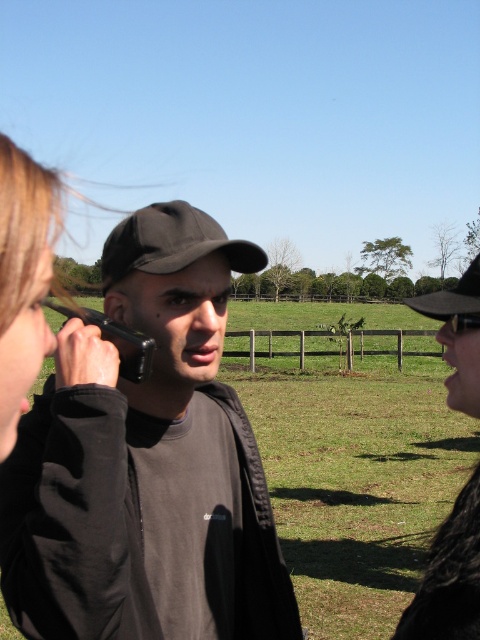
You are standing in the scene and want to place a new object at the point with coordinates (117, 340). What object is already located there?

The point at coordinates (117, 340) is occupied by the black matte smartphone at left.

You are a photographer trying to capture a group photo of the matte black cap at center and the black fabric baseball cap at center. Since you want to ensure both caps are fully visible in the frame, which cap should you position closer to the camera to avoid being blocked by the other?

The matte black cap at center is taller than the black fabric baseball cap at center, so you should position the black fabric baseball cap at center closer to the camera to prevent it from being blocked by the taller matte black cap at center.

You are a photographer trying to capture a group photo of the matte black cap at center and the black textured hat at right. The camera you have can only focus on objects within a 20 inch range. Will both subjects be in focus?

The matte black cap at center is 21.22 inches from the black textured hat at right, which is beyond the camera focus range of 20 inches. Therefore, both subjects cannot be in focus simultaneously.